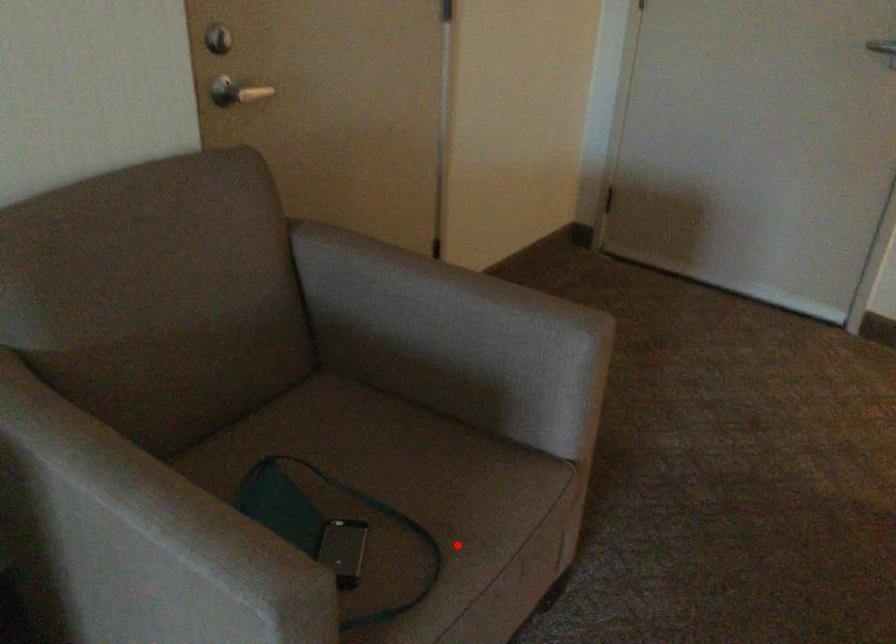
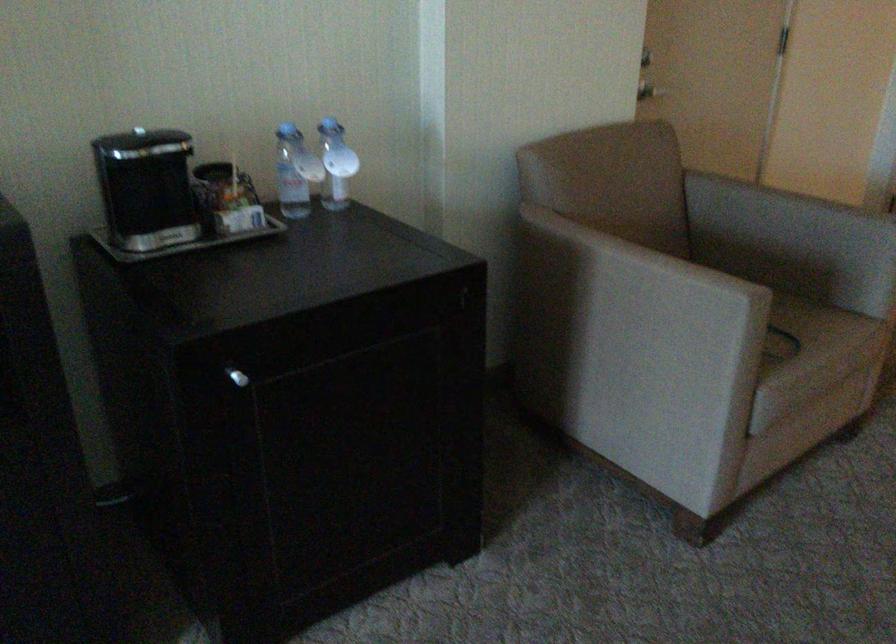
Question: A red point is marked in image1. In image2, is the corresponding 3D point closer to the camera or farther? Reply with the corresponding letter.

Choices:
 (A) The corresponding 3D point is closer.
 (B) The corresponding 3D point is farther.

Answer: (B)